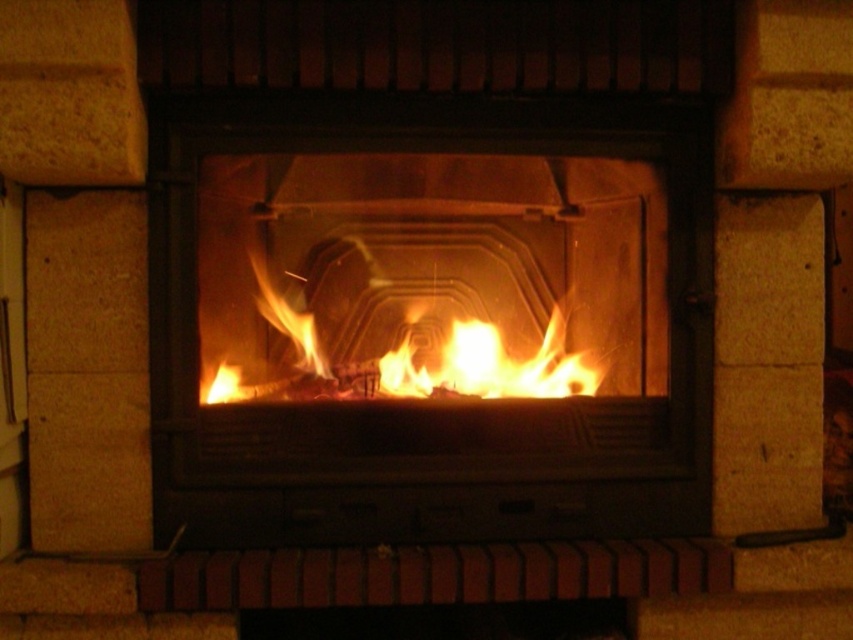
Is point (426, 410) positioned before point (254, 280)?

Yes, it is.

Is matte black fireplace at center smaller than flametransparentfire at center?

No, matte black fireplace at center is not smaller than flametransparentfire at center.

This screenshot has height=640, width=853. What do you see at coordinates (431, 316) in the screenshot?
I see `matte black fireplace at center` at bounding box center [431, 316].

In order to click on matte black fireplace at center in this screenshot , I will do `click(431, 316)`.